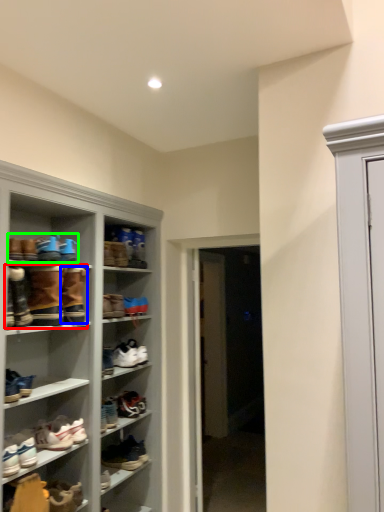
Question: Considering the real-world distances, which object is closest to footwear (highlighted by a red box)? footwear (highlighted by a blue box) or footwear (highlighted by a green box).

Choices:
 (A) footwear
 (B) footwear

Answer: (A)